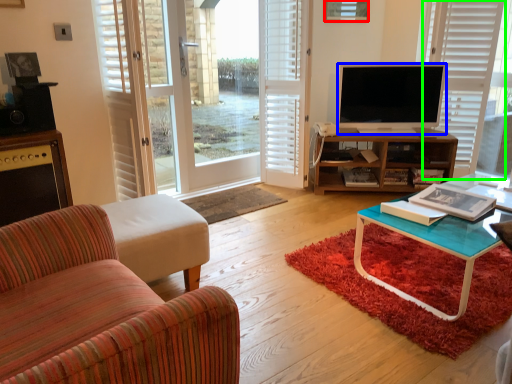
Question: Estimate the real-world distances between objects in this image. Which object is farther from picture frame (highlighted by a red box), television (highlighted by a blue box) or blind (highlighted by a green box)?

Choices:
 (A) television
 (B) blind

Answer: (B)